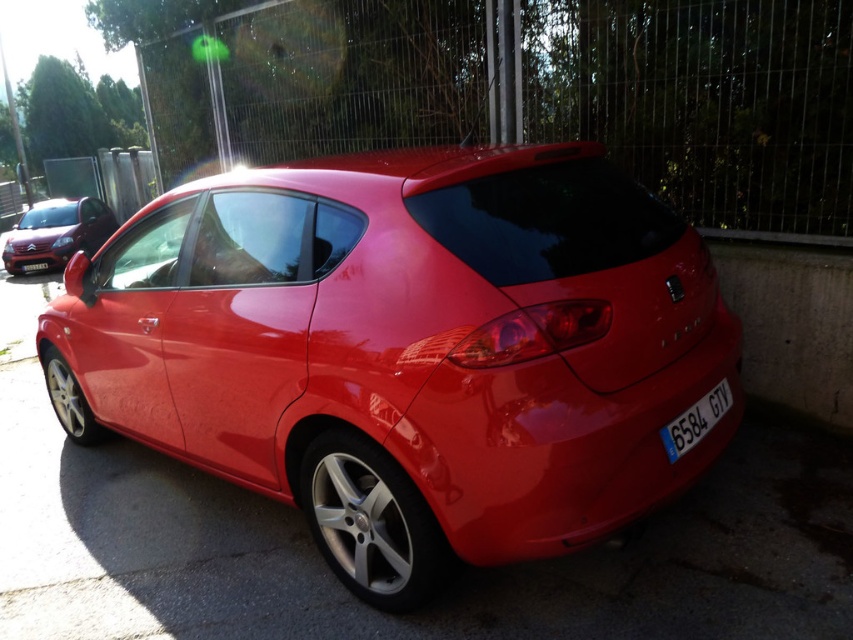
You are a photographer trying to capture both the glossy red car at center and the glossy metallic car at left in a single shot. Based on their positions, which car should you focus on first to ensure both are in frame?

The glossy red car at center is closer to the viewer than the glossy metallic car at left. To ensure both cars are in frame, focus on the glossy metallic car at left first since it is farther away and adjust the camera angle to include the closer glossy red car at center.

You are a photographer trying to capture a closeup of the white plastic license plate at center while also ensuring the glossy metallic car at left is visible in the frame. Given that your camera has a maximum focus range of 36 inches, will you be able to capture both objects clearly in the same photo?

The glossy metallic car at left is 36.09 inches from the white plastic license plate at center. Since the distance between them is slightly over the camera maximum focus range of 36 inches, you won not be able to capture both objects clearly in the same photo.